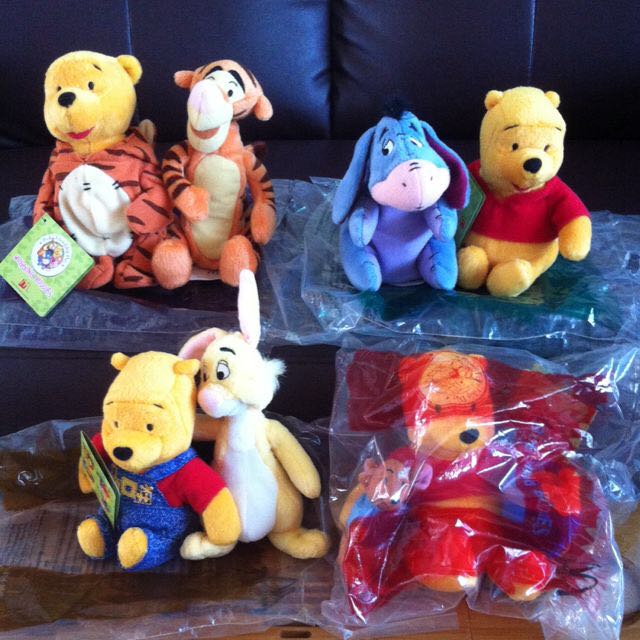
Where is `winne the pooh plushies`? winne the pooh plushies is located at coordinates (114, 198), (223, 186), (416, 219), (523, 212), (468, 460), (259, 473), (173, 491).